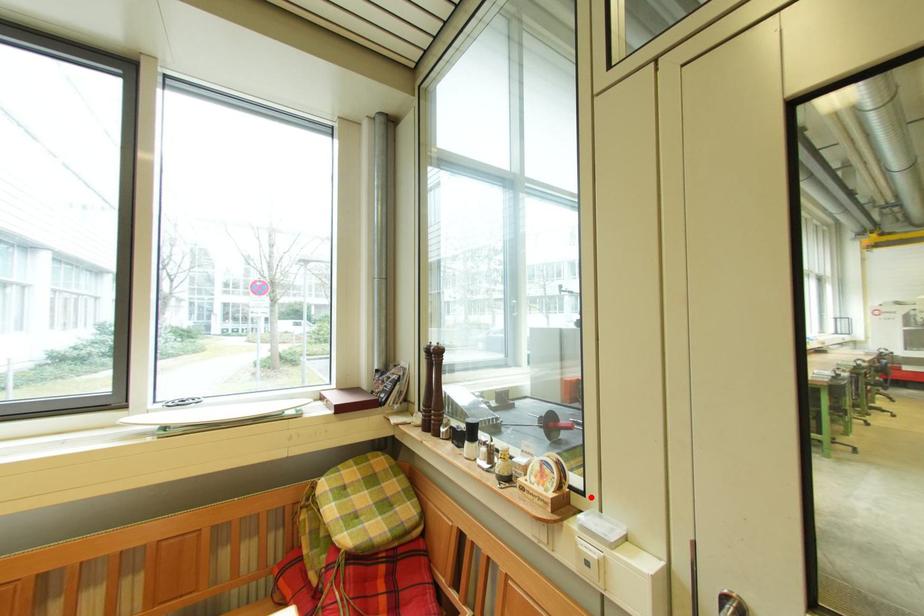
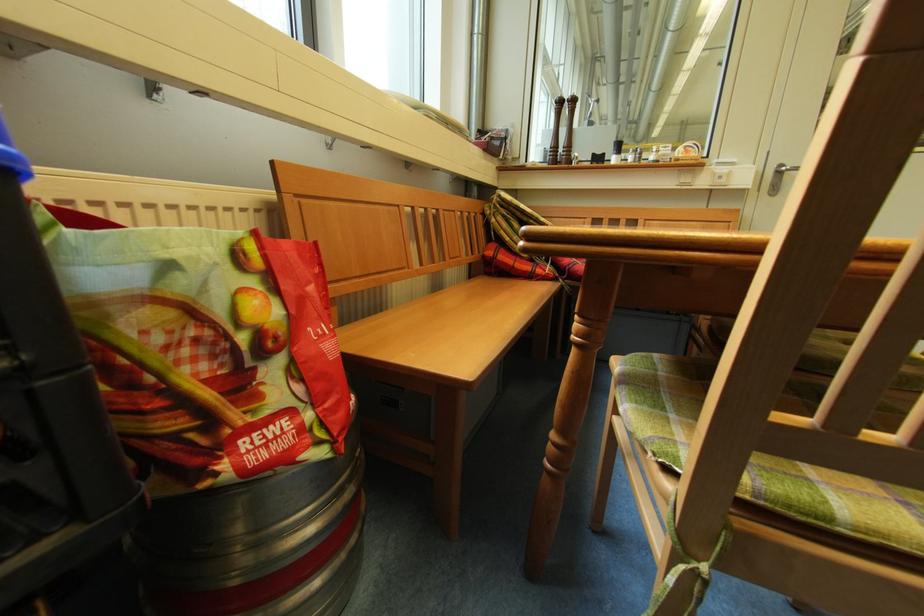
Find the pixel in the second image that matches the highlighted location in the first image.

(714, 160)